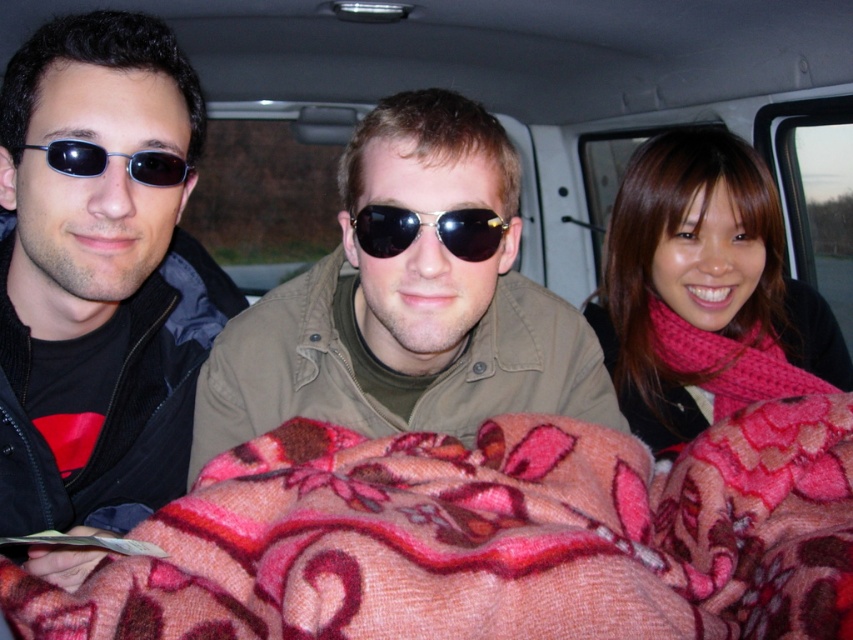
Who is more forward, [213,388] or [148,166]?

Point [148,166] is in front.

Does matte brown jacket at center have a larger size compared to matte black sunglasses at left?

Correct, matte brown jacket at center is larger in size than matte black sunglasses at left.

Where is `matte brown jacket at center`? The height and width of the screenshot is (640, 853). matte brown jacket at center is located at coordinates (408, 300).

Which of these two, matte black jacket at left or pink knitted scarf at upper right, stands shorter?

pink knitted scarf at upper right is shorter.

Find the location of a particular element. Image resolution: width=853 pixels, height=640 pixels. matte black jacket at left is located at coordinates (93, 269).

At what (x,y) coordinates should I click in order to perform the action: click on matte black jacket at left. Please return your answer as a coordinate pair (x, y). This screenshot has height=640, width=853. Looking at the image, I should click on (93, 269).

Which of these two, pink knitted scarf at upper right or matte black sunglasses at left, stands shorter?

matte black sunglasses at left is shorter.

Does point (746, 289) lie in front of point (79, 164)?

No, it is behind (79, 164).

Image resolution: width=853 pixels, height=640 pixels. What do you see at coordinates (705, 291) in the screenshot?
I see `pink knitted scarf at upper right` at bounding box center [705, 291].

Identify the location of pink knitted scarf at upper right. The image size is (853, 640). (705, 291).